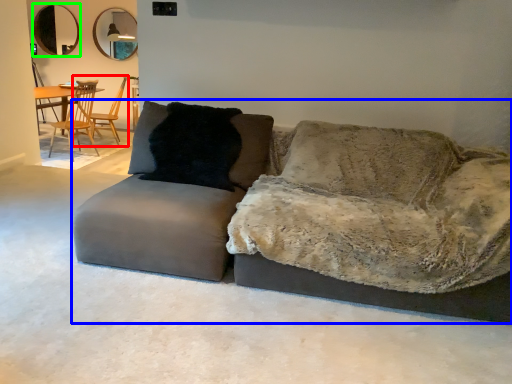
Question: Considering the real-world distances, which object is farthest from chair (highlighted by a red box)? studio couch (highlighted by a blue box) or mirror (highlighted by a green box)?

Choices:
 (A) studio couch
 (B) mirror

Answer: (A)